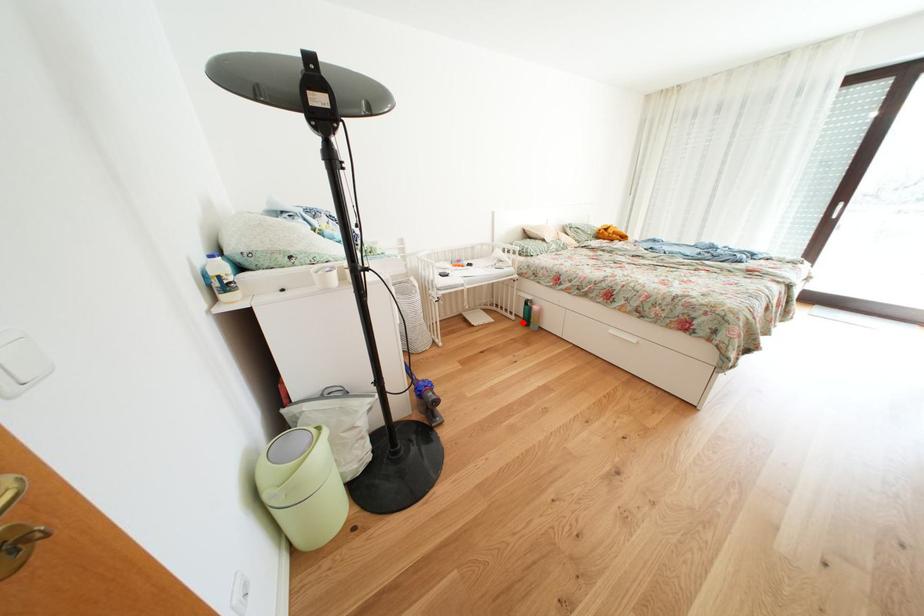
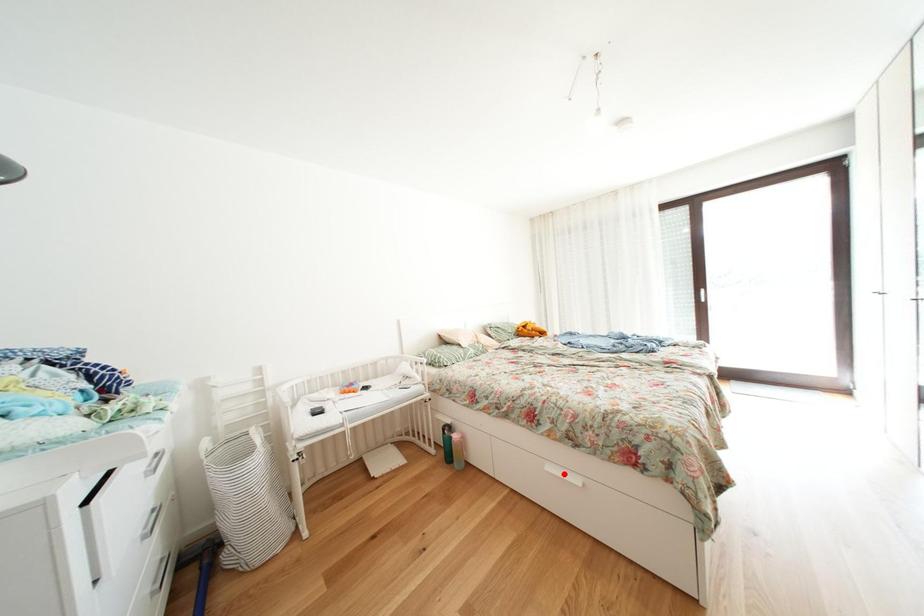
I am providing you with two images of the same scene from different viewpoints. A red point is marked on the first image and another point is marked on the second image. Are the points marked in image1 and image2 representing the same 3D position?

No